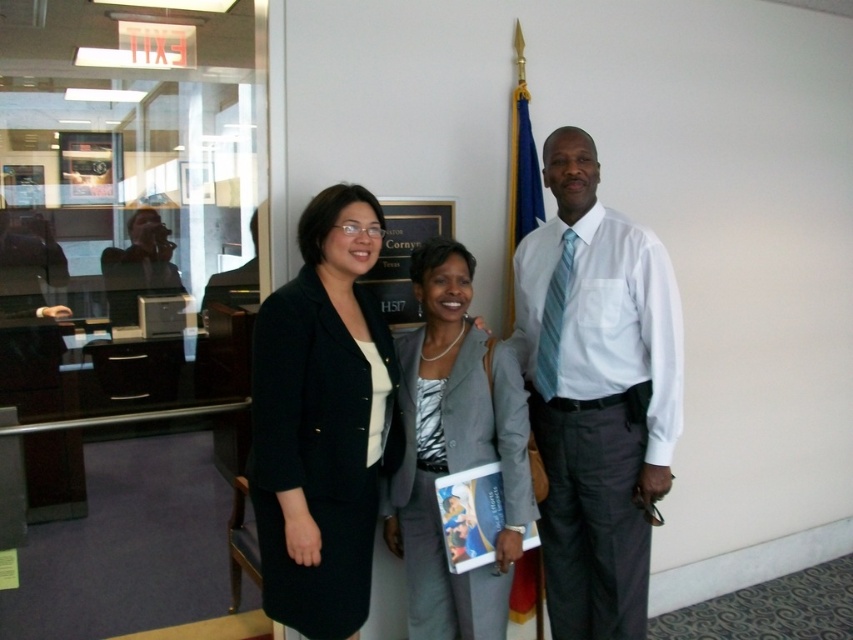
Based on the scene description, which object has a smaller width between the white glossy shirt at center and the matte black laptop at left?

The white glossy shirt at center has a lesser width compared to the matte black laptop at left.

Based on the scene description, where is the black woolen blazer at center located in the image?

The black woolen blazer at center is located at point 0.706 on the horizontal axis and 0.374 on the vertical axis.

You are a photographer adjusting the camera settings to ensure all subjects are in focus. The camera has a depth of field that can cover 10 inches. Are the black woolen blazer at center and the gray fabric suit at center within the same depth of field?

The black woolen blazer at center is 9.91 inches away from the gray fabric suit at center. Since the distance is less than the camera depth of field of 10 inches, both are within the same depth of field and will be in focus.